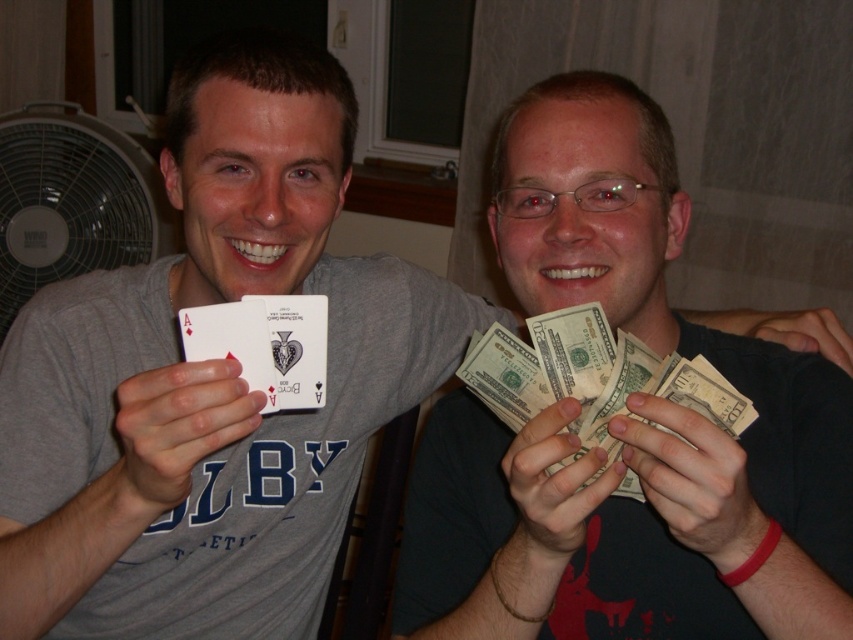
You are a game referee observing the card game between the two individuals. You notice the white plastic fan at left and the matte plastic playing card at center. Which object is positioned closer to the left side of the scene?

The white plastic fan at left is positioned closer to the left side of the scene than the matte plastic playing card at center.

You are a game developer designing a card game interface. You need to place a white matte card at center in the scene. Where should you position it?

The white matte card at center should be positioned at point (173, 432).

You are a game designer analyzing this card game scene. You need to determine if the white plastic fan at left can be used to cover the matte plastic playing card at center without overlapping any other objects. Can it be done?

The white plastic fan at left is larger in size than the matte plastic playing card at center, so yes, it can cover the matte plastic playing card at center without overlapping other objects as long as their positions allow it.